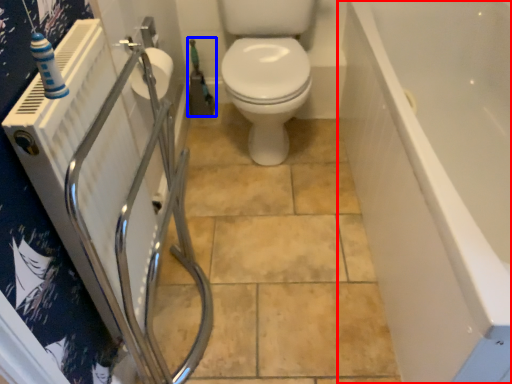
Question: Which object is closer to the camera taking this photo, bath (highlighted by a red box) or garden hose (highlighted by a blue box)?

Choices:
 (A) bath
 (B) garden hose

Answer: (A)